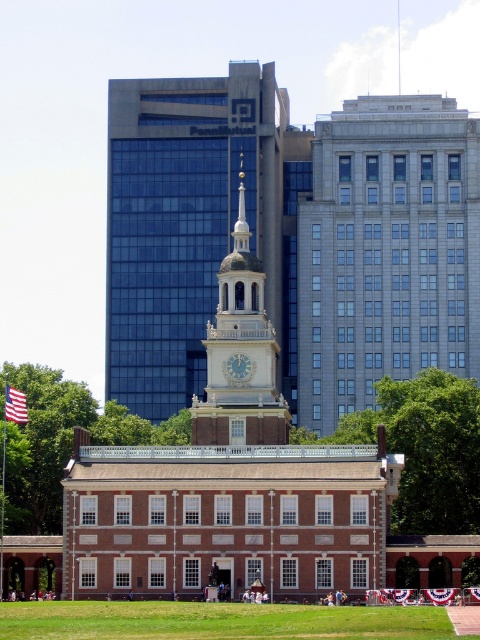
You are standing in front of the gray stone clock tower at center and want to take a photo of the green leafy tree at lower left. In which direction should you move to get the tree in your camera frame?

You should move to the left because the gray stone clock tower at center is to the right of the green leafy tree at lower left, so moving left will bring the tree into view.

You are standing at the point marked as point [385,250] in the image. What architectural feature can you see directly in front of you?

The gray stone clock tower at center is located at point [385,250], so you can see the gray stone clock tower at center directly in front of you.

Based on the photo, you are standing in front of the gray stone clock tower at center and want to take a photo of the green leafy tree at lower left. Will the tree be visible in the photo if you don not move your position?

The green leafy tree at lower left is behind the gray stone clock tower at center, so it will not be visible in the photo if you do not move your position.